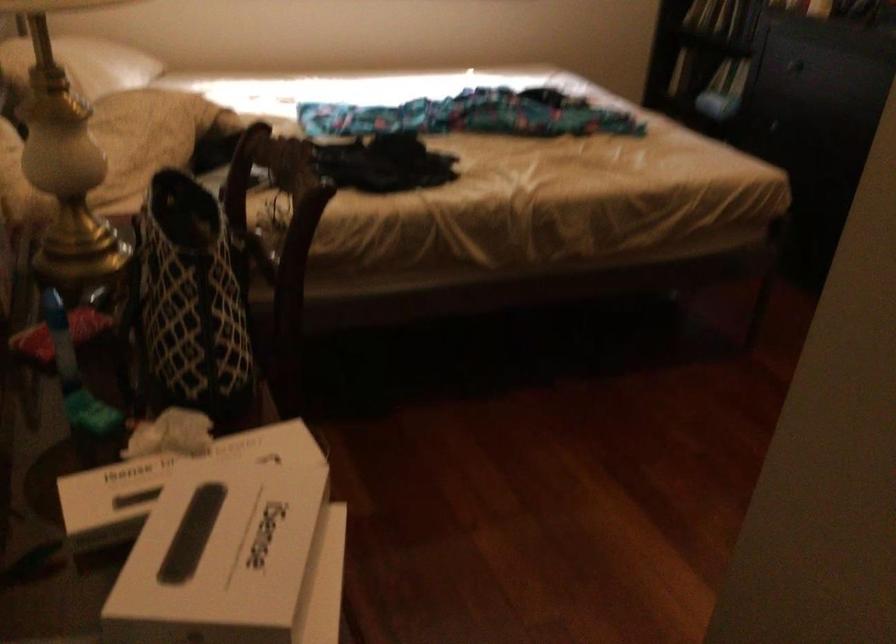
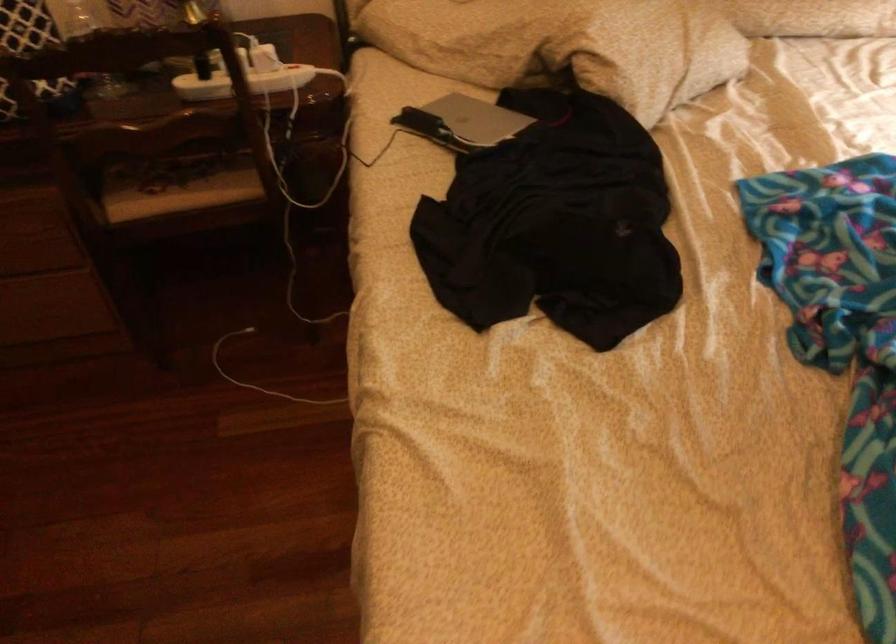
Locate, in the second image, the point that corresponds to [233,198] in the first image.

(243, 82)